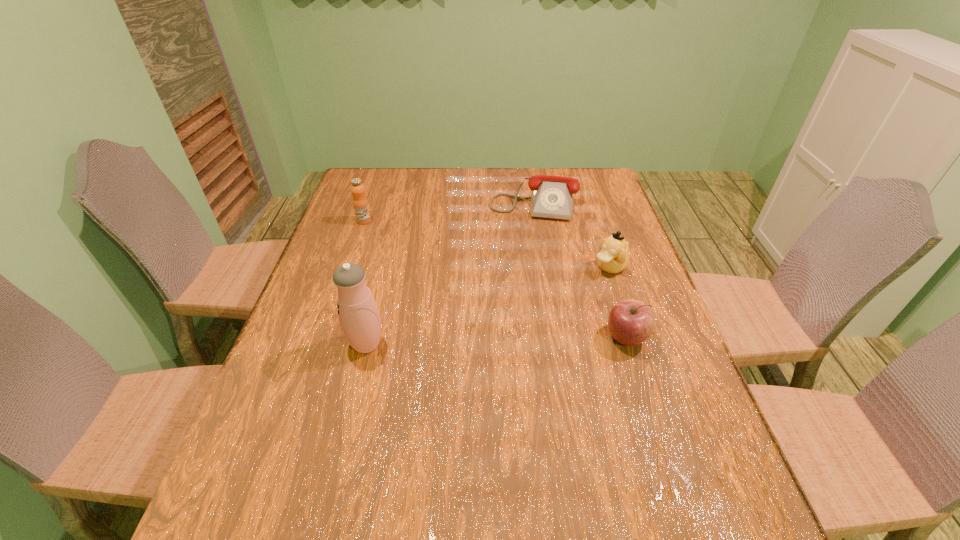
Locate an element on the screen. The width and height of the screenshot is (960, 540). vacant spot on the desktop that is between the thermos bottle and the apple and is positioned on the face of the third nearest object is located at coordinates (494, 341).

Where is `free space on the desktop that is between the second object from left to right and the apple and is positioned on the dial of the shortest object`? The height and width of the screenshot is (540, 960). free space on the desktop that is between the second object from left to right and the apple and is positioned on the dial of the shortest object is located at coordinates (513, 341).

Identify the location of vacant space on the desktop that is between the thermos bottle and the apple and is positioned on the front label of the orange juice. (526, 340).